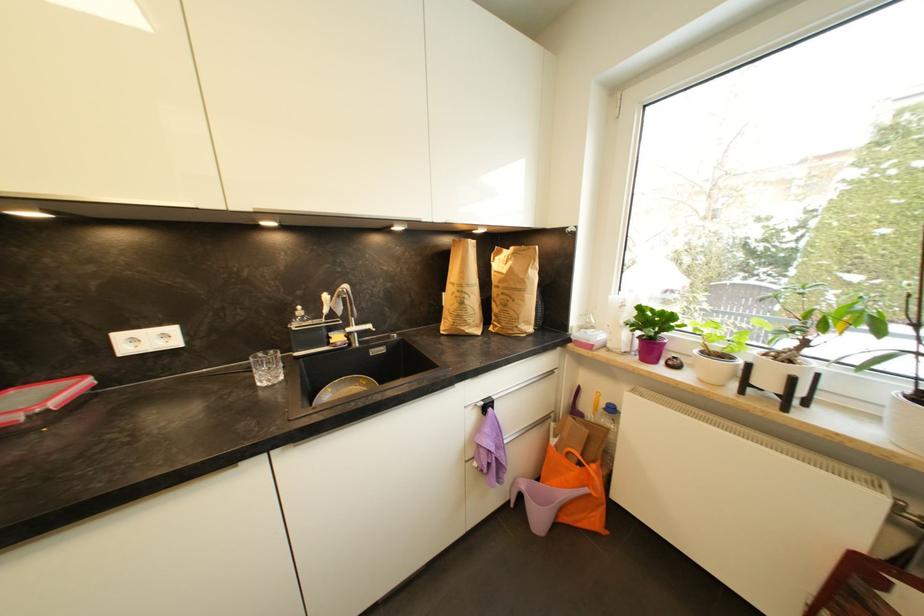
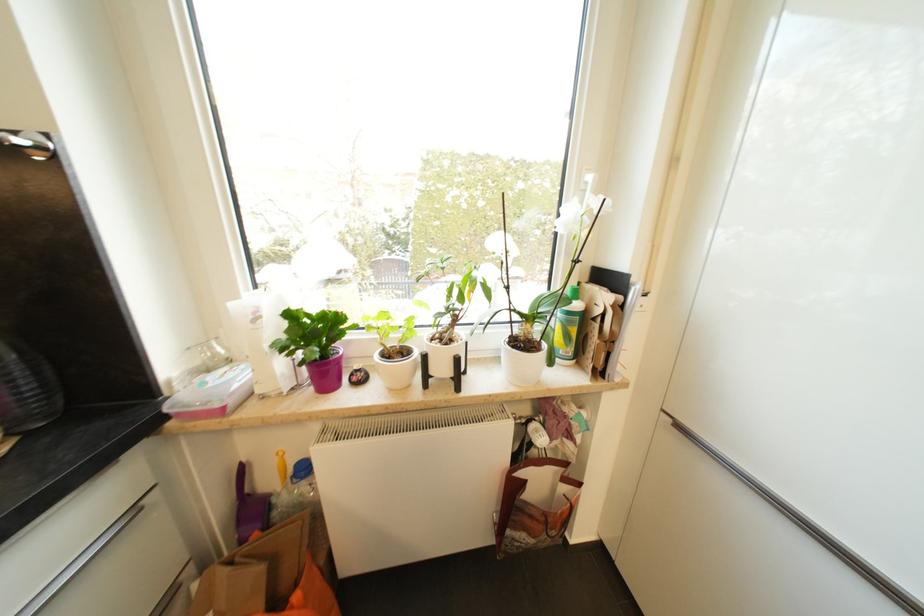
In the second image, find the point that corresponds to point (608, 407) in the first image.

(295, 471)